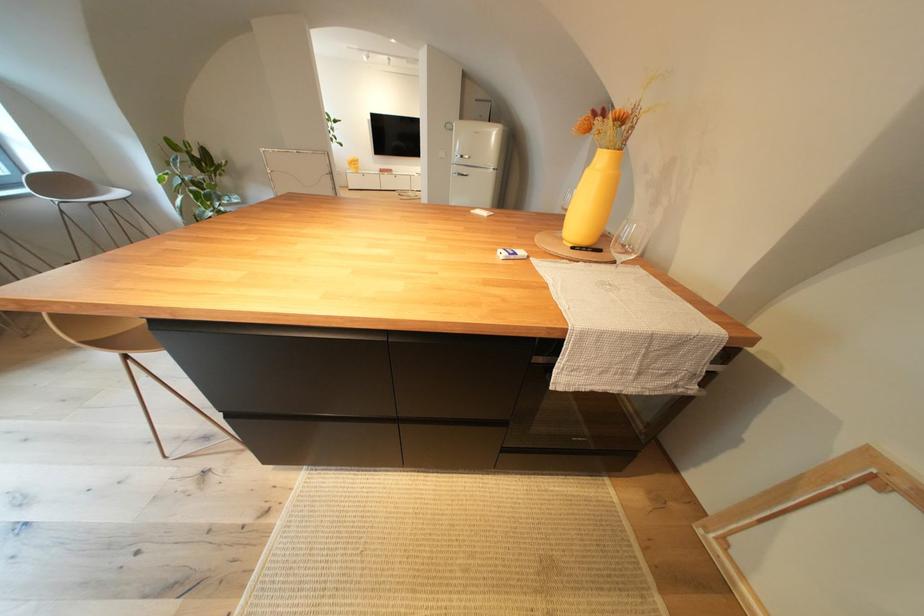
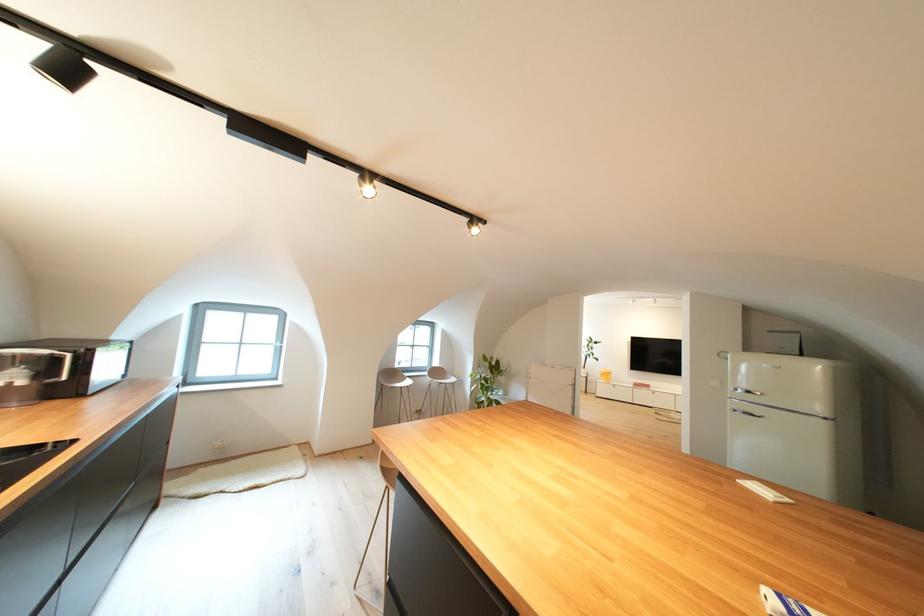
The first image is from the beginning of the video and the second image is from the end. How did the camera likely rotate when shooting the video?

The rotation direction of the camera is left-up.